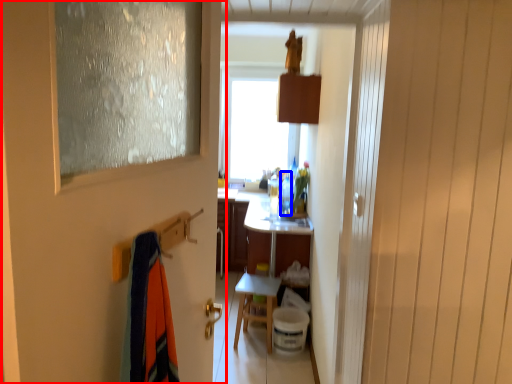
Question: Among these objects, which one is nearest to the camera, door (highlighted by a red box) or bottle (highlighted by a blue box)?

Choices:
 (A) door
 (B) bottle

Answer: (A)